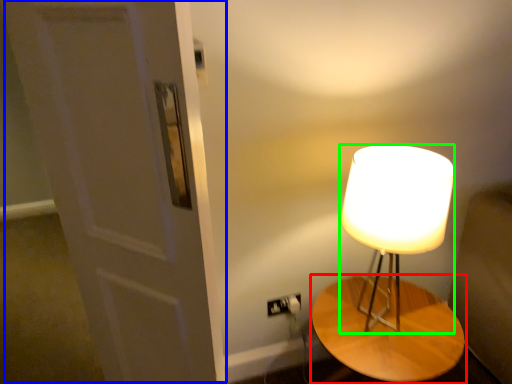
Question: Estimate the real-world distances between objects in this image. Which object is closer to table (highlighted by a red box), door (highlighted by a blue box) or lamp (highlighted by a green box)?

Choices:
 (A) door
 (B) lamp

Answer: (B)